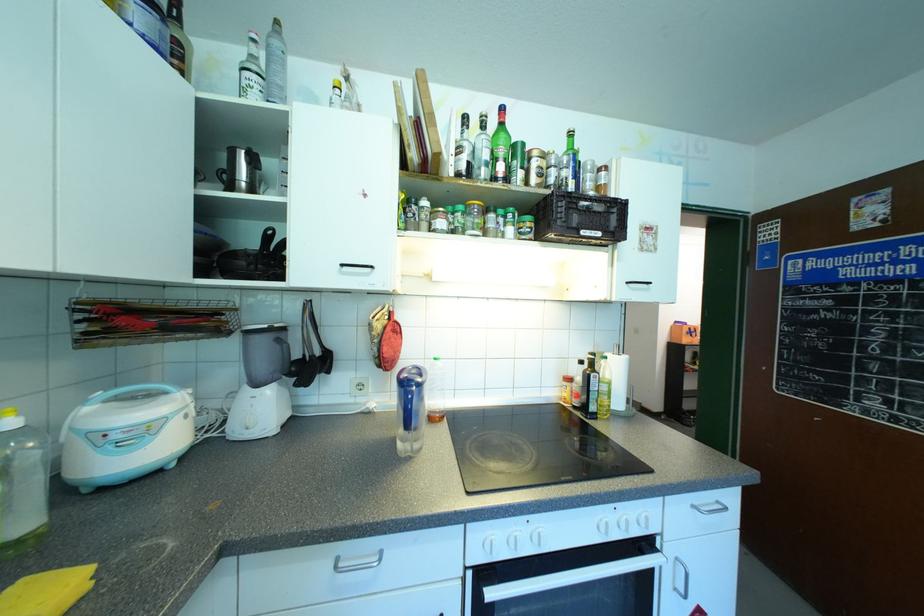
The height and width of the screenshot is (616, 924). What do you see at coordinates (710, 507) in the screenshot?
I see `the silver oven handle` at bounding box center [710, 507].